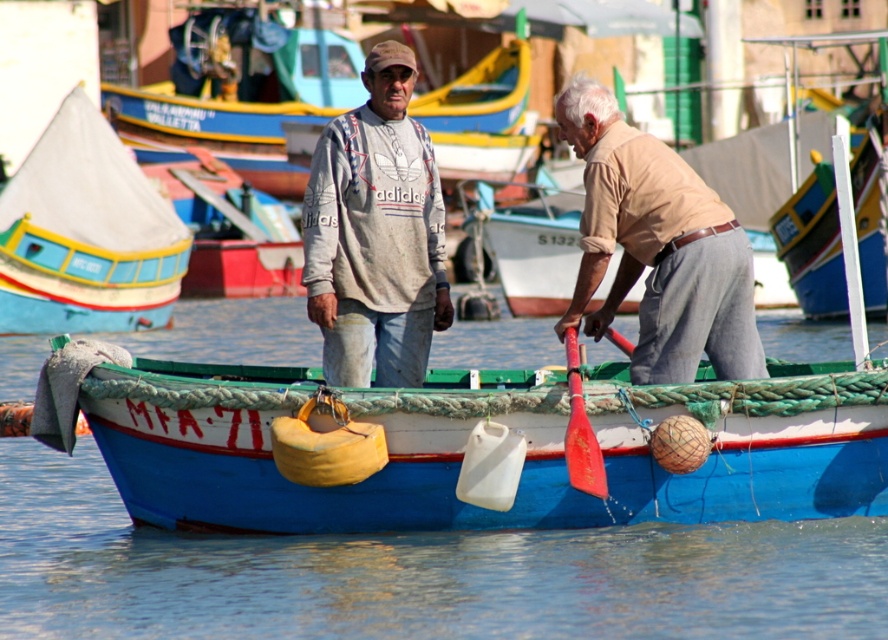
You are a photographer trying to capture the blue painted wood boat at center and the gray cotton sweatshirt at center in the same frame. Based on their sizes, which object will appear larger in your photo?

The blue painted wood boat at center will appear larger in the photo because its width is larger than the gray cotton sweatshirt at center.

You are a photographer trying to capture the matte brown boat at center and the beige cotton shirt at right in a single frame. Considering their heights, which object will appear larger in the photo?

The matte brown boat at center will appear larger in the photo because it is taller than the beige cotton shirt at right.

You are a photographer trying to capture a photo of the blue painted wood boat at center and the gray cotton sweatshirt at center. Which object should you focus on first if you want to include both in your frame without moving the camera?

The gray cotton sweatshirt at center is on the left side of the blue painted wood boat at center, so you should focus on the gray cotton sweatshirt at center first to ensure both are in frame.